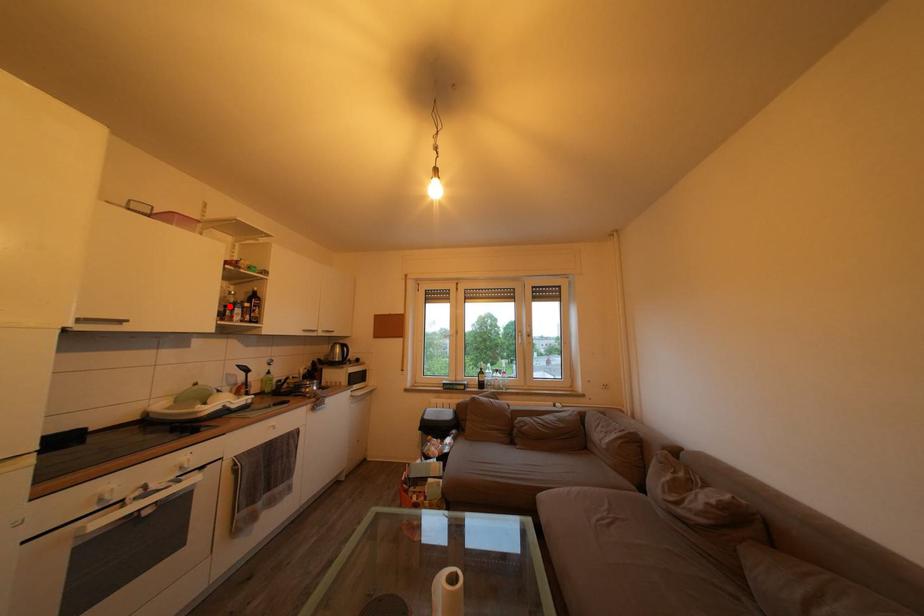
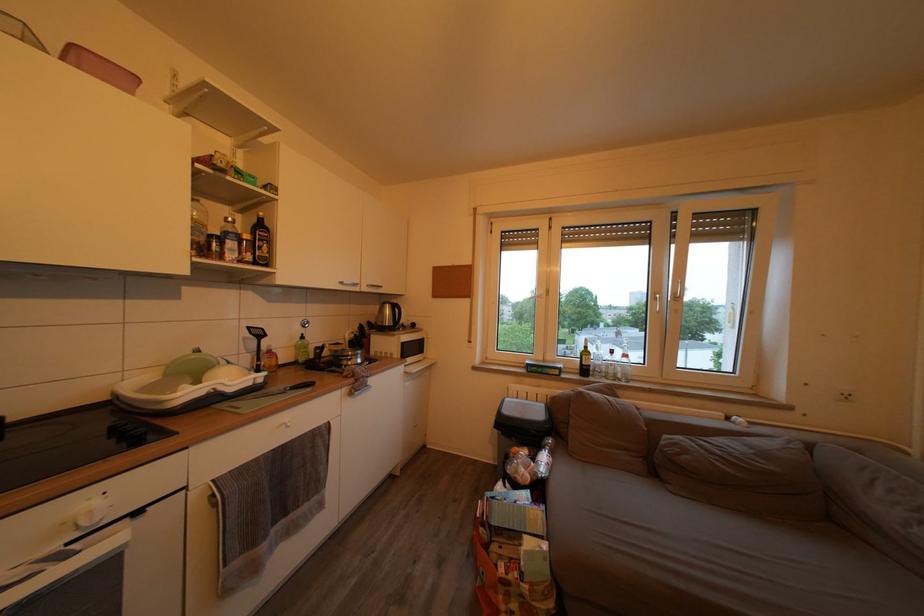
Find the pixel in the second image that matches the highlighted location in the first image.

(205, 230)